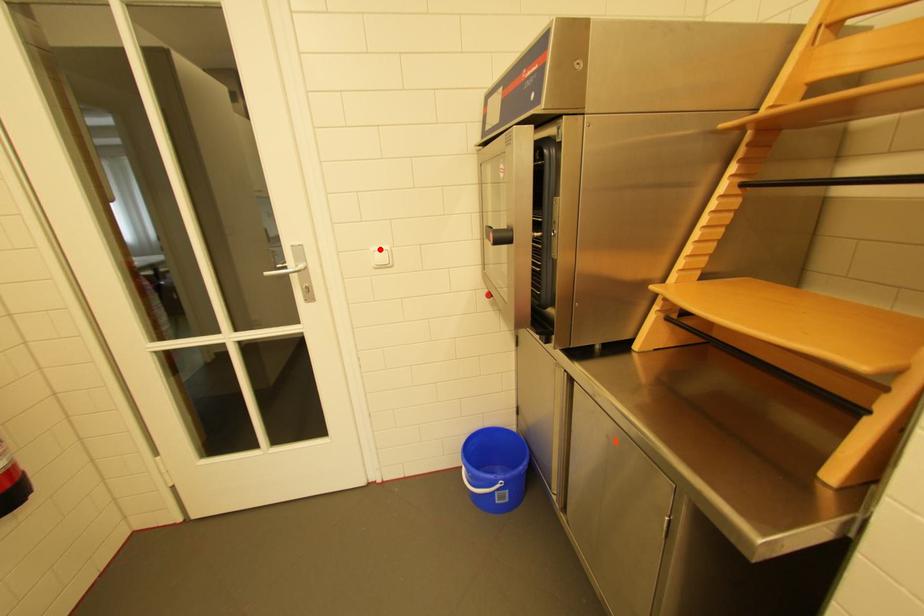
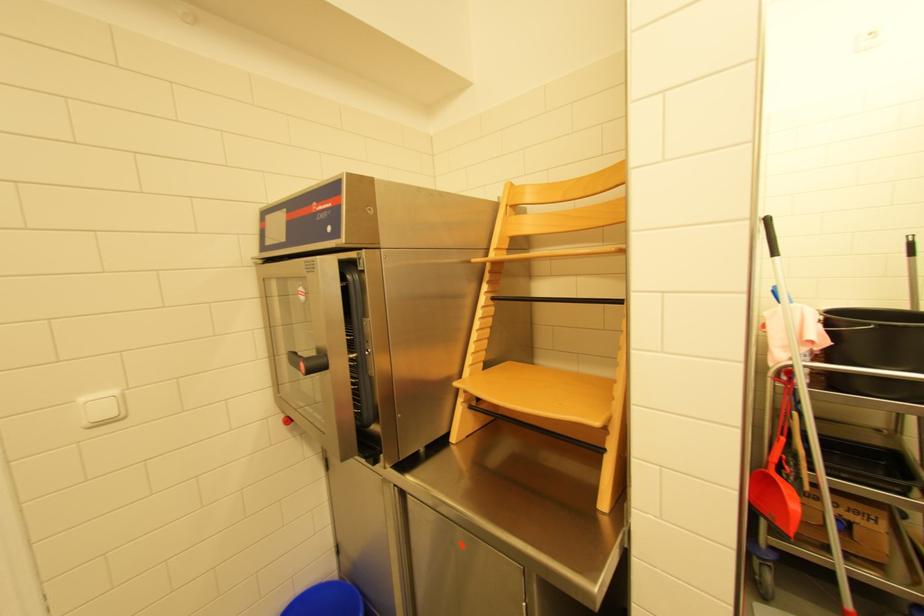
Find the pixel in the second image that matches the highlighted location in the first image.

(90, 400)